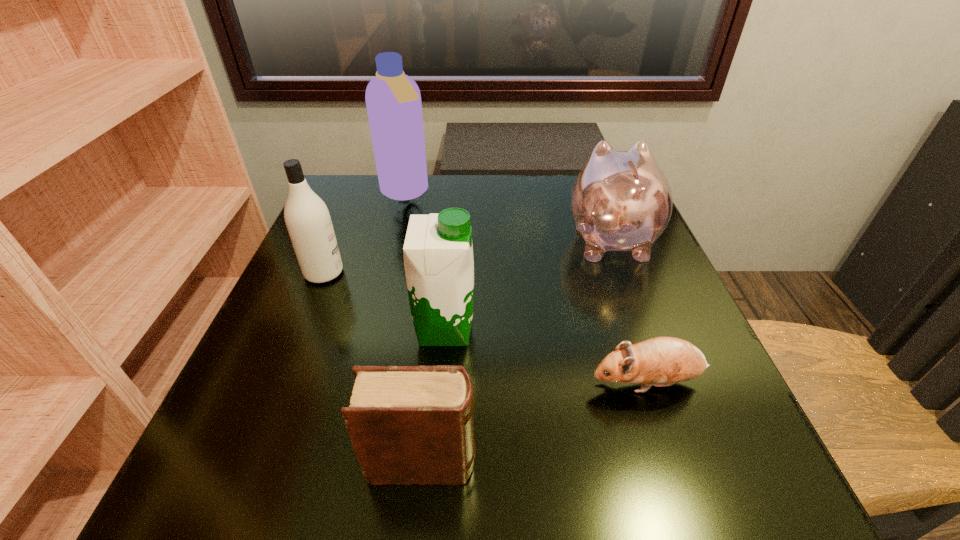
Locate an element on the screen. Image resolution: width=960 pixels, height=540 pixels. shampoo that is at the far edge is located at coordinates (x=393, y=100).

Identify the location of piggy bank located at the far edge. (620, 201).

Where is `object situated at the near edge`? The width and height of the screenshot is (960, 540). object situated at the near edge is located at coordinates (408, 425).

Where is `piggy bank positioned at the right edge`? piggy bank positioned at the right edge is located at coordinates (620, 201).

At what (x,y) coordinates should I click in order to perform the action: click on hamster that is at the right edge. Please return your answer as a coordinate pair (x, y). Looking at the image, I should click on (662, 361).

Where is `object present at the far left corner`? The width and height of the screenshot is (960, 540). object present at the far left corner is located at coordinates (393, 100).

Find the location of `object that is at the far right corner`. object that is at the far right corner is located at coordinates (620, 201).

What are the coordinates of `vacant space at the far edge` in the screenshot? It's located at (512, 174).

In the image, there is a desktop. At what (x,y) coordinates should I click in order to perform the action: click on free space at the left edge. Please return your answer as a coordinate pair (x, y). Looking at the image, I should click on (347, 277).

In the image, there is a desktop. Where is `vacant space at the right edge`? Image resolution: width=960 pixels, height=540 pixels. vacant space at the right edge is located at coordinates (623, 336).